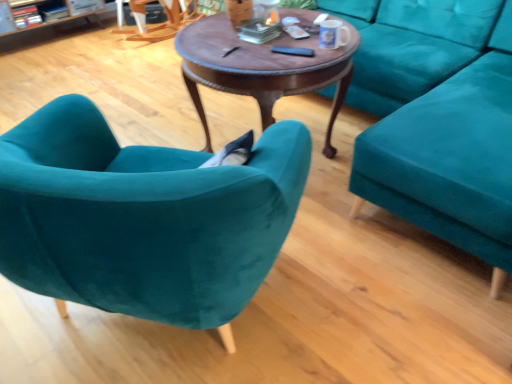
This screenshot has height=384, width=512. Identify the location of unoccupied space behind white glossy mug at upper center. (331, 40).